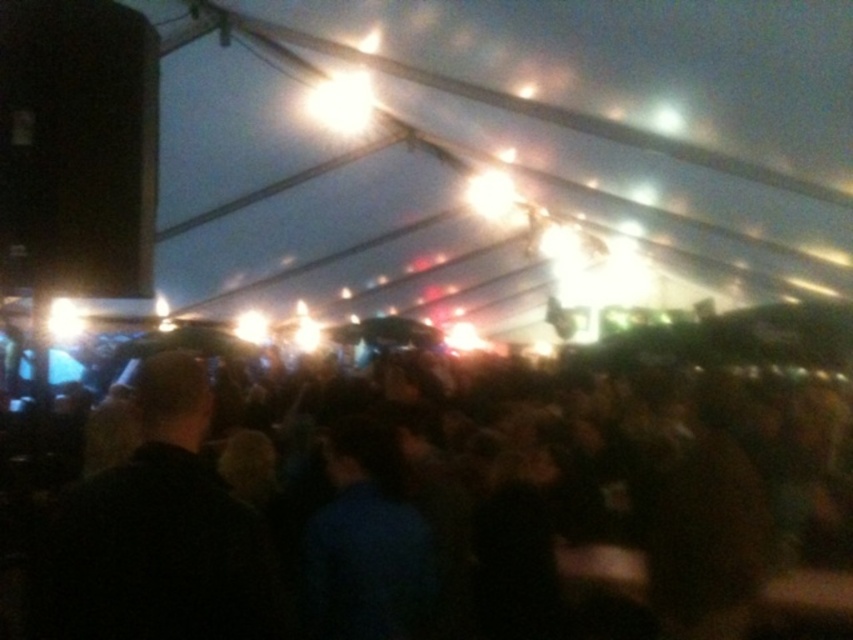
Question: Which point is closer to the camera taking this photo?

Choices:
 (A) (347, 566)
 (B) (196, 461)

Answer: (B)

Question: Which point appears farthest from the camera in this image?

Choices:
 (A) (585, 468)
 (B) (71, 634)

Answer: (A)

Question: Is black matte crowd at center smaller than dark hair at center?

Choices:
 (A) no
 (B) yes

Answer: (A)

Question: Which object is closer to the camera taking this photo?

Choices:
 (A) dark hair at center
 (B) black matte crowd at center

Answer: (A)

Question: Does black matte crowd at center appear on the left side of dark hair at center?

Choices:
 (A) no
 (B) yes

Answer: (A)

Question: Does black matte crowd at center have a larger size compared to dark hair at center?

Choices:
 (A) yes
 (B) no

Answer: (A)